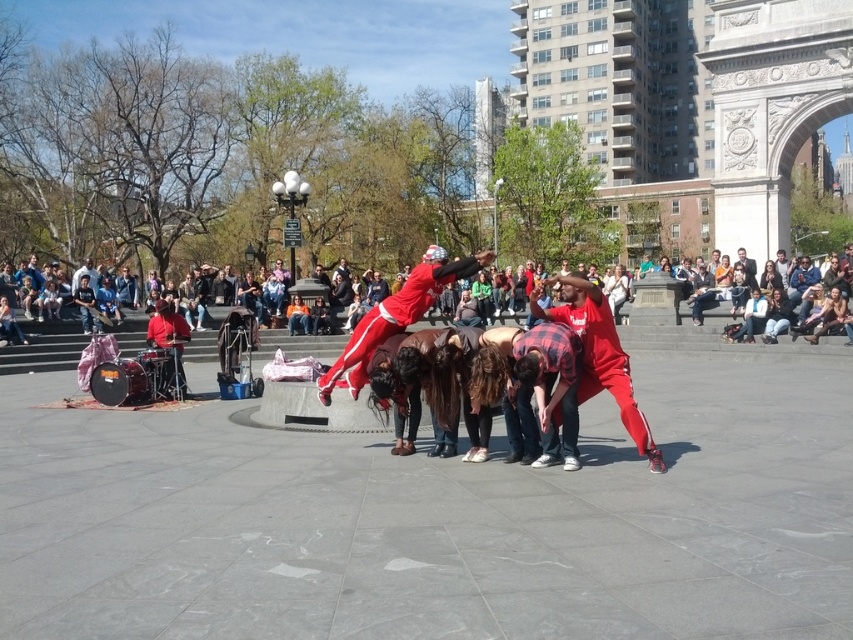
Question: Can you confirm if matte red clothing at center is positioned to the right of red plaid shirt at center?

Choices:
 (A) no
 (B) yes

Answer: (A)

Question: Which object is closer to the camera taking this photo?

Choices:
 (A) red plaid shirt at center
 (B) matte red clothing at center

Answer: (A)

Question: Can you confirm if red plaid shirt at center is positioned to the right of matte red pants at center?

Choices:
 (A) no
 (B) yes

Answer: (B)

Question: Which object is farther from the camera taking this photo?

Choices:
 (A) matte red pants at center
 (B) red plaid shirt at center

Answer: (A)

Question: Which point is farther to the camera?

Choices:
 (A) (659, 337)
 (B) (570, 323)

Answer: (A)

Question: Can you confirm if matte red clothing at center is smaller than red plaid shirt at center?

Choices:
 (A) yes
 (B) no

Answer: (B)